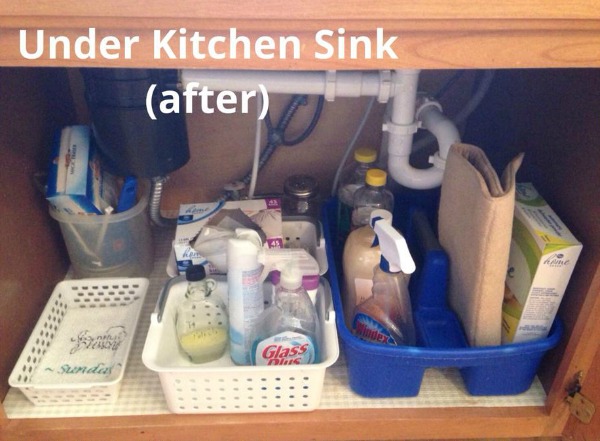
This screenshot has width=600, height=441. In order to click on blue plastic cleaning supply holder in this screenshot , I will do `click(441, 359)`.